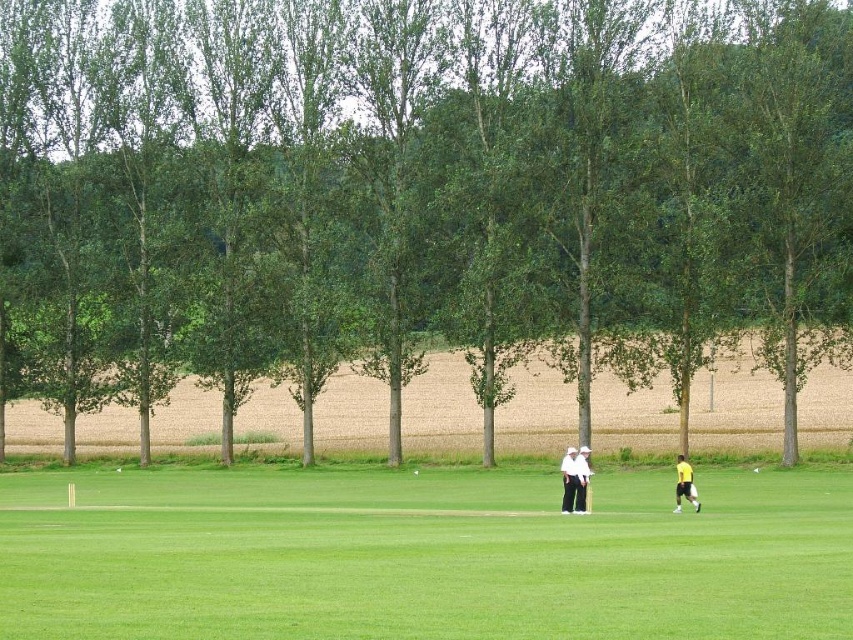
You are a photographer trying to capture a clear shot of both the white cotton shirt and trousers at center and the yellow fabric person at lower right. Based on their positions, which one is closer to the camera?

The white cotton shirt and trousers at center is positioned over the yellow fabric person at lower right, meaning it is closer to the camera.

Consider the image. You are a photographer standing at the edge of the cricket field. You want to take a photo that includes both the white cotton shirt and trousers at center and the yellow fabric person at lower right. Based on their positions, which of these two people will appear larger in your photo?

The white cotton shirt and trousers at center will appear larger in the photo because they are closer to the photographer than the yellow fabric person at lower right.

You are a photographer trying to capture a photo of the green leafy tree at center and the white cotton shirt and trousers at center. Which object would you need to focus on first if you want both to be in sharp focus?

The green leafy tree at center is much taller than the white cotton shirt and trousers at center, so you should focus on the white cotton shirt and trousers at center first to ensure both are in sharp focus.